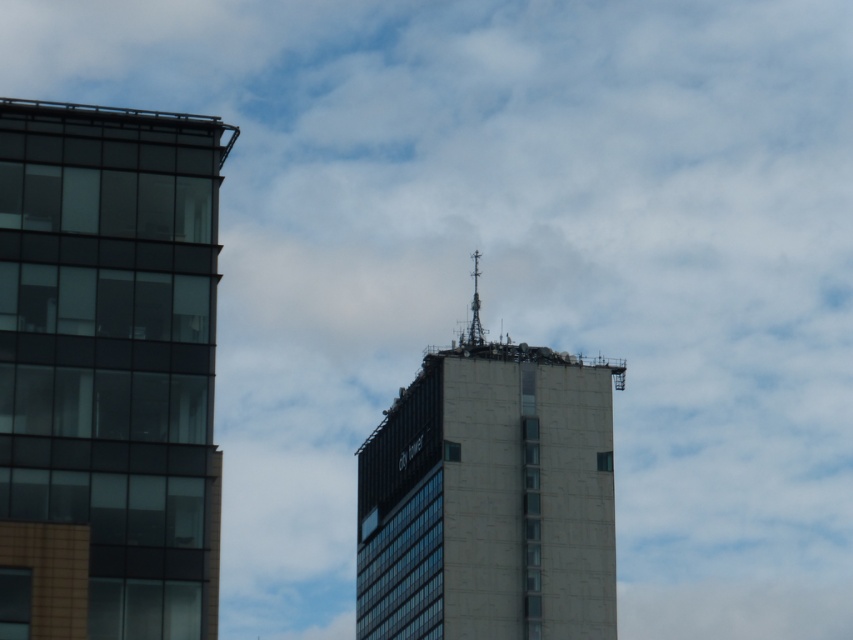
Question: Is transparent glass building at left above concrete tower at center?

Choices:
 (A) no
 (B) yes

Answer: (B)

Question: Among these points, which one is nearest to the camera?

Choices:
 (A) (216, 160)
 (B) (613, 582)

Answer: (A)

Question: Which point is farther to the camera?

Choices:
 (A) (619, 368)
 (B) (149, 458)

Answer: (A)

Question: Among these points, which one is nearest to the camera?

Choices:
 (A) pos(74,632)
 (B) pos(544,444)

Answer: (A)

Question: Does transparent glass building at left appear over concrete tower at center?

Choices:
 (A) no
 (B) yes

Answer: (B)

Question: Is transparent glass building at left to the right of concrete tower at center from the viewer's perspective?

Choices:
 (A) no
 (B) yes

Answer: (A)